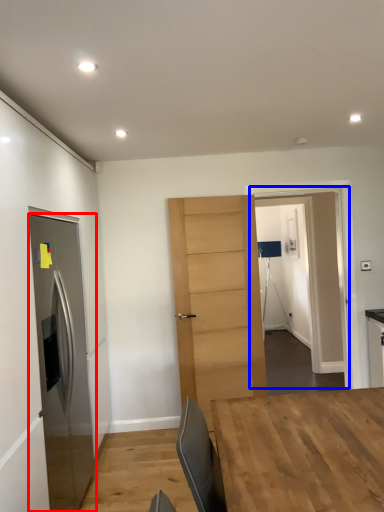
Question: Which point is further to the camera, door (highlighted by a red box) or glass door (highlighted by a blue box)?

Choices:
 (A) door
 (B) glass door

Answer: (B)